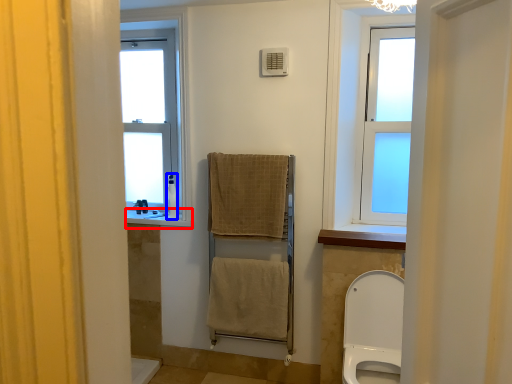
Question: Which of the following is the closest to the observer, window sill (highlighted by a red box) or toiletry (highlighted by a blue box)?

Choices:
 (A) window sill
 (B) toiletry

Answer: (A)